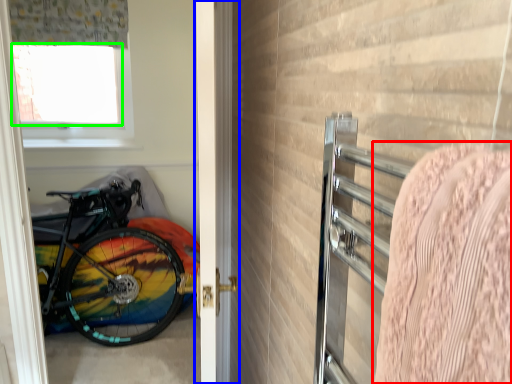
Question: Considering the real-world distances, which object is closest to blanket (highlighted by a red box)? door (highlighted by a blue box) or window screen (highlighted by a green box).

Choices:
 (A) door
 (B) window screen

Answer: (A)